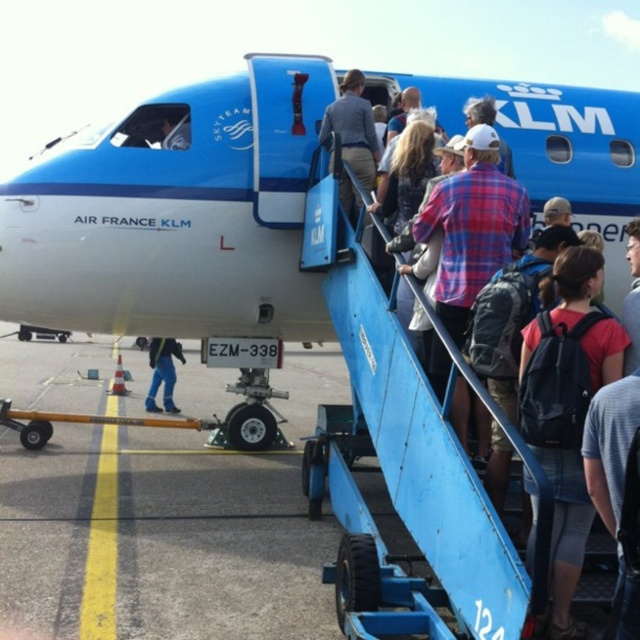
Consider the image. You are a passenger at the airport and see the blue matte airplane at center and the dark blue jeans at lower left. Which object is positioned to the right side from your perspective?

The blue matte airplane at center is to the right of dark blue jeans at lower left, so the blue matte airplane at center is positioned to the right side.

You are standing at point [177,212] in the airport scene. What object is located exactly at your current position?

The blue matte airplane at center is located exactly at point [177,212].

You are standing at the point labeled point (621, 164) and want to walk to the point labeled point (182, 356). Which direction should you turn to face the direction of your destination?

You should turn to face the direction towards the point (182, 356). Since point (621, 164) is in front of point (182, 356), you need to turn backward or behind to face the direction of your destination.